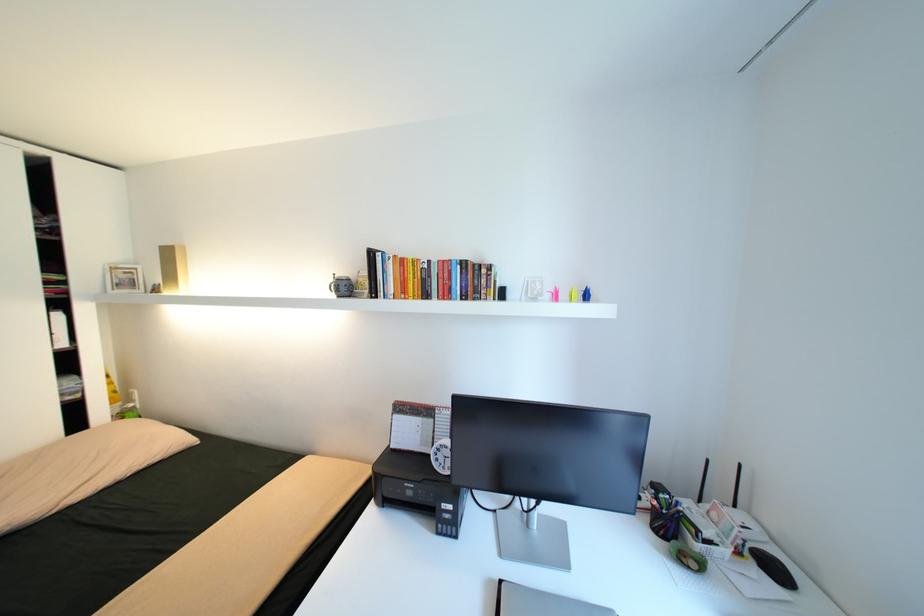
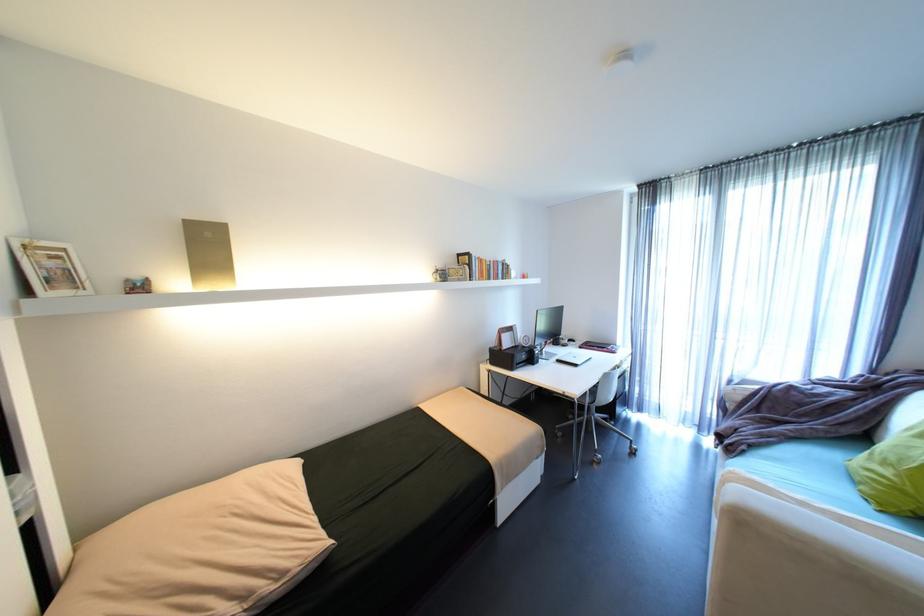
Find the pixel in the second image that matches point 342,275 in the first image.

(444, 267)